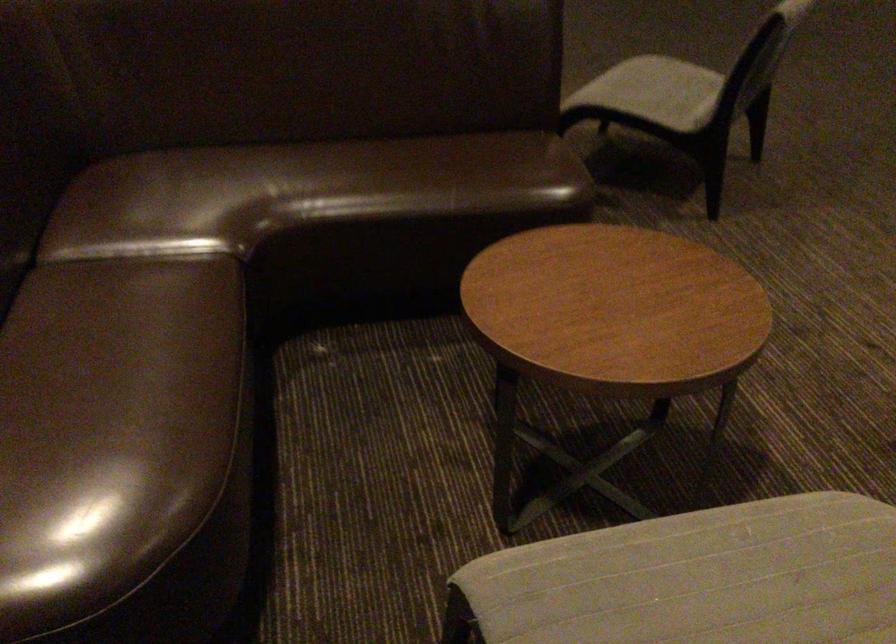
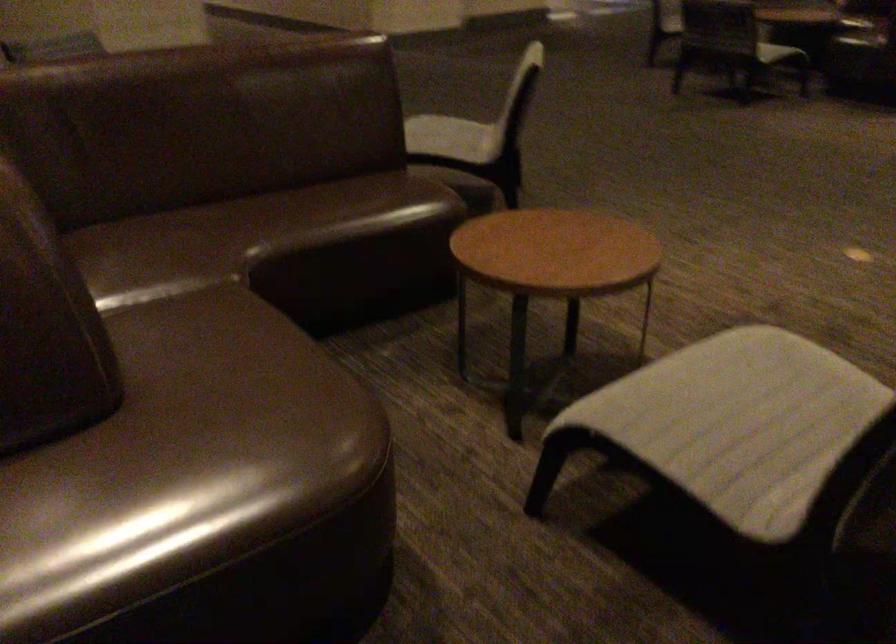
The images are taken continuously from a first-person perspective. In which direction are you moving?

The cameraman moved toward left, backward.